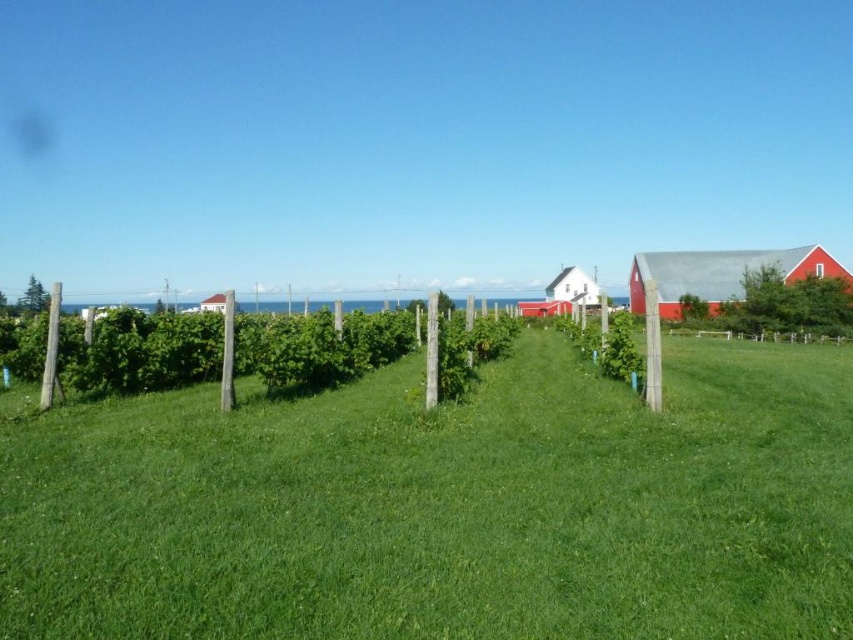
In the scene shown: Is green leafy hedge at center bigger than red matte barn at right?

Actually, green leafy hedge at center might be smaller than red matte barn at right.

You are a GUI agent. You are given a task and a screenshot of the screen. Output one action in this format:
    pyautogui.click(x=<x>, y=<y>)
    Task: Click on the green leafy hedge at center
    This screenshot has width=853, height=640.
    Given the screenshot: What is the action you would take?
    pyautogui.click(x=140, y=352)

Does green grassy at center appear on the left side of white matte barn at center?

Correct, you'll find green grassy at center to the left of white matte barn at center.

Which is more to the left, green grassy at center or white matte barn at center?

green grassy at center

Is point (593, 436) farther from viewer compared to point (573, 289)?

No, it is in front of (573, 289).

Where is `green grassy at center`? The height and width of the screenshot is (640, 853). green grassy at center is located at coordinates (445, 506).

Does green grassy at center have a greater width compared to red matte barn at right?

No.

Can you confirm if green grassy at center is smaller than red matte barn at right?

Yes.

Where is `green grassy at center`? This screenshot has height=640, width=853. green grassy at center is located at coordinates (445, 506).